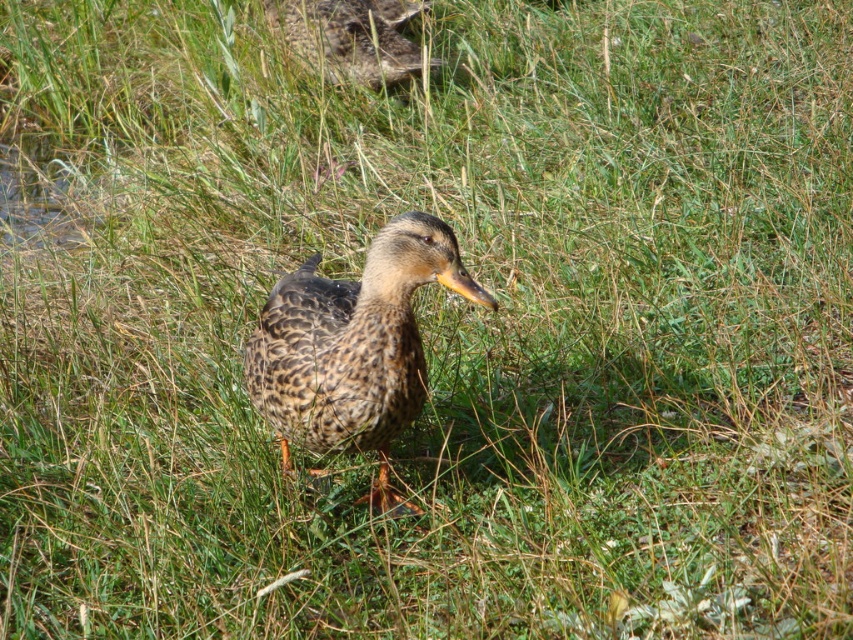
Question: Does speckled feathered duck at center appear on the left side of speckled feathered duck at upper center?

Choices:
 (A) yes
 (B) no

Answer: (B)

Question: Which point is closer to the camera?

Choices:
 (A) speckled feathered duck at upper center
 (B) speckled feathered duck at center

Answer: (B)

Question: Can you confirm if speckled feathered duck at center is positioned to the left of speckled feathered duck at upper center?

Choices:
 (A) yes
 (B) no

Answer: (B)

Question: Considering the relative positions of speckled feathered duck at center and speckled feathered duck at upper center in the image provided, where is speckled feathered duck at center located with respect to speckled feathered duck at upper center?

Choices:
 (A) above
 (B) below

Answer: (B)